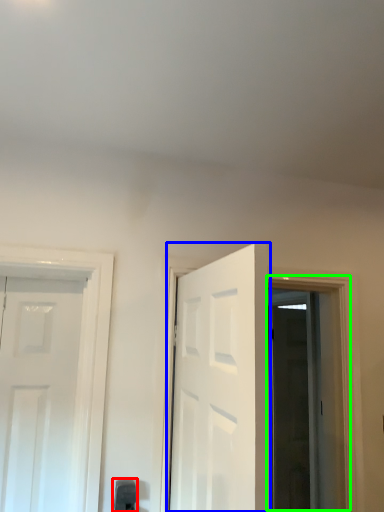
Question: Considering the real-world distances, which object is farthest from door handle (highlighted by a red box)? door (highlighted by a blue box) or window (highlighted by a green box)?

Choices:
 (A) door
 (B) window

Answer: (B)